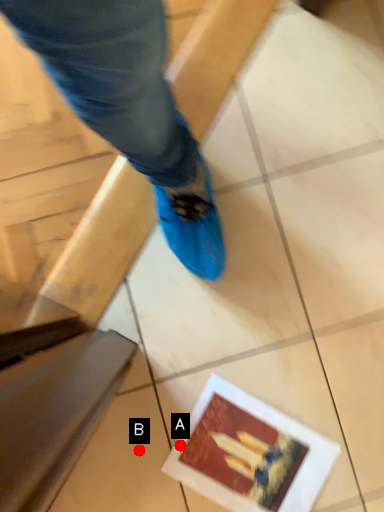
Question: Two points are circled on the image, labeled by A and B beside each circle. Which point is closer to the camera?

Choices:
 (A) A is closer
 (B) B is closer

Answer: (B)